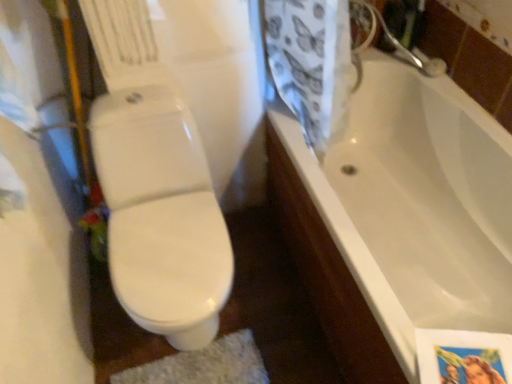
Where is `white glossy toilet at center`? Image resolution: width=512 pixels, height=384 pixels. white glossy toilet at center is located at coordinates (161, 215).

The height and width of the screenshot is (384, 512). What do you see at coordinates (161, 215) in the screenshot?
I see `white glossy toilet at center` at bounding box center [161, 215].

The image size is (512, 384). Describe the element at coordinates (415, 204) in the screenshot. I see `white glossy bathtub at right` at that location.

Measure the distance between white glossy bathtub at right and camera.

The distance of white glossy bathtub at right from camera is 1.28 meters.

Identify the location of white glossy bathtub at right. The height and width of the screenshot is (384, 512). (415, 204).

The image size is (512, 384). I want to click on white glossy toilet at center, so tap(161, 215).

Visually, is white glossy toilet at center positioned to the left or to the right of white glossy bathtub at right?

white glossy toilet at center is positioned on white glossy bathtub at right's left side.

Considering the positions of objects white glossy toilet at center and white glossy bathtub at right in the image provided, who is behind, white glossy toilet at center or white glossy bathtub at right?

white glossy toilet at center is more distant.

Which is in front, point (189, 208) or point (410, 373)?

The point (410, 373) is in front.

From the image's perspective, would you say white glossy toilet at center is shown under white glossy bathtub at right?

Yes, from the image's perspective, white glossy toilet at center is beneath white glossy bathtub at right.

From a real-world perspective, is white glossy toilet at center located beneath white glossy bathtub at right?

No.

Does white glossy toilet at center have a greater width compared to white glossy bathtub at right?

No.

Which of these two, white glossy toilet at center or white glossy bathtub at right, stands shorter?

With less height is white glossy bathtub at right.

Based on the photo, can you confirm if white glossy toilet at center is smaller than white glossy bathtub at right?

Indeed, white glossy toilet at center has a smaller size compared to white glossy bathtub at right.

Which is correct: white glossy toilet at center is inside white glossy bathtub at right, or outside of it?

The correct answer is: outside.

Are white glossy toilet at center and white glossy bathtub at right far apart?

No, white glossy toilet at center is not far from white glossy bathtub at right.

Is white glossy bathtub at right at the back of white glossy toilet at center?

white glossy toilet at center is not turned away from white glossy bathtub at right.

How different are the orientations of white glossy toilet at center and white glossy bathtub at right in degrees?

89.8 degrees.

Measure the distance between white glossy toilet at center and white glossy bathtub at right.

white glossy toilet at center is 76.55 centimeters from white glossy bathtub at right.

At what (x,y) coordinates should I click in order to perform the action: click on bathtub that appears in front of the white glossy toilet at center. Please return your answer as a coordinate pair (x, y). The width and height of the screenshot is (512, 384). Looking at the image, I should click on (415, 204).

Is white glossy bathtub at right to the left or to the right of white glossy toilet at center in the image?

white glossy bathtub at right is to the right of white glossy toilet at center.

Which object is closer to the camera taking this photo, white glossy bathtub at right or white glossy toilet at center?

white glossy bathtub at right.

Does point (367, 152) lie behind point (187, 274)?

Yes, it is.

From the image's perspective, would you say white glossy bathtub at right is positioned over white glossy toilet at center?

Yes.

From a real-world perspective, which is physically above, white glossy bathtub at right or white glossy toilet at center?

white glossy toilet at center is physically above.

Is white glossy bathtub at right wider or thinner than white glossy toilet at center?

white glossy bathtub at right is wider than white glossy toilet at center.

Can you confirm if white glossy bathtub at right is taller than white glossy toilet at center?

No.

Who is bigger, white glossy bathtub at right or white glossy toilet at center?

white glossy bathtub at right.

Is white glossy bathtub at right outside of white glossy toilet at center?

Yes, white glossy bathtub at right is not within white glossy toilet at center.

Is white glossy bathtub at right with white glossy toilet at center?

white glossy bathtub at right is not next to white glossy toilet at center, and they're not touching.

Is white glossy bathtub at right facing towards white glossy toilet at center?

Yes, white glossy bathtub at right is aimed at white glossy toilet at center.

Find the location of a particular element. The image size is (512, 384). bathtub in front of the white glossy toilet at center is located at coordinates (415, 204).

Locate an element on the screen. The image size is (512, 384). toilet above the white glossy bathtub at right (from a real-world perspective) is located at coordinates (161, 215).

In order to click on bathtub on the right of white glossy toilet at center in this screenshot , I will do `click(415, 204)`.